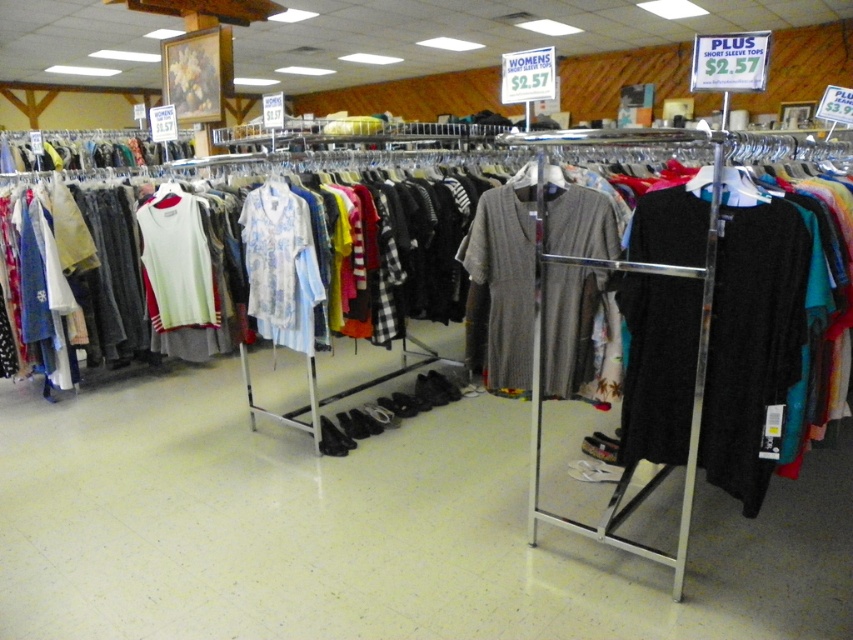
Question: Which point is closer to the camera?

Choices:
 (A) (581, 220)
 (B) (293, 252)

Answer: (A)

Question: Can you confirm if knit gray dress at center is bigger than light blue floral fabric shirt at center?

Choices:
 (A) yes
 (B) no

Answer: (A)

Question: Which point appears farthest from the camera in this image?

Choices:
 (A) (260, 330)
 (B) (558, 246)

Answer: (A)

Question: Does knit gray dress at center have a smaller size compared to light blue floral fabric shirt at center?

Choices:
 (A) yes
 (B) no

Answer: (B)

Question: Is knit gray dress at center wider than light blue floral fabric shirt at center?

Choices:
 (A) no
 (B) yes

Answer: (B)